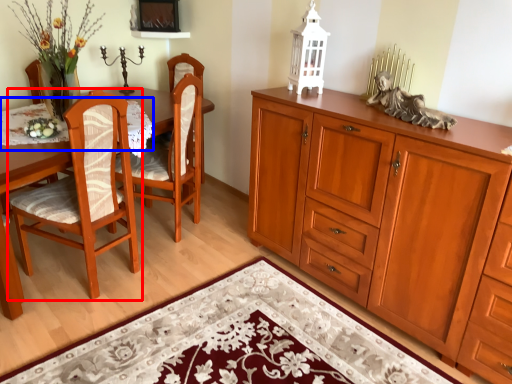
Question: Which of the following is the closest to the observer, chair (highlighted by a red box) or tablecloth (highlighted by a blue box)?

Choices:
 (A) chair
 (B) tablecloth

Answer: (A)